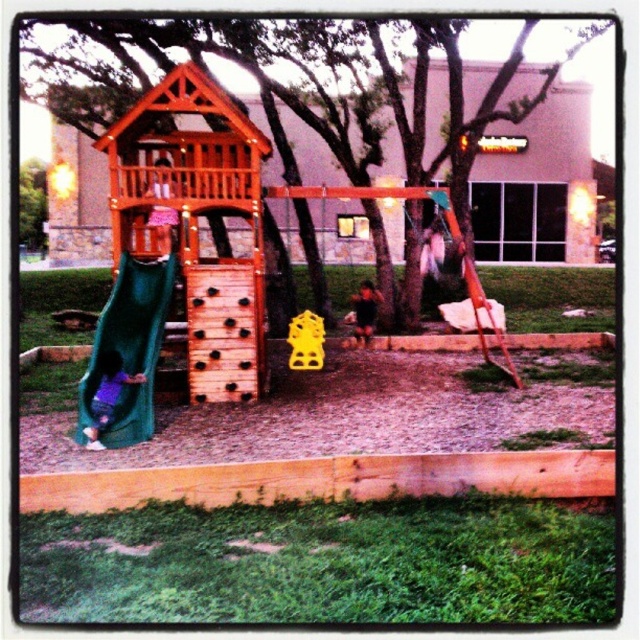
Question: Which point appears closest to the camera in this image?

Choices:
 (A) (108, 365)
 (B) (358, 324)
 (C) (147, 412)

Answer: (C)

Question: Which object is closer to the camera taking this photo?

Choices:
 (A) dark brown hair at center
 (B) purple fabric slide at lower left
 (C) green fabric slide at left

Answer: (B)

Question: Does purple fabric slide at lower left come in front of dark brown hair at center?

Choices:
 (A) no
 (B) yes

Answer: (B)

Question: Can you confirm if green fabric slide at left is bigger than dark brown hair at center?

Choices:
 (A) yes
 (B) no

Answer: (A)

Question: Among these objects, which one is nearest to the camera?

Choices:
 (A) dark brown hair at center
 (B) purple fabric slide at lower left

Answer: (B)

Question: Is purple fabric slide at lower left to the left of dark brown hair at center from the viewer's perspective?

Choices:
 (A) yes
 (B) no

Answer: (A)